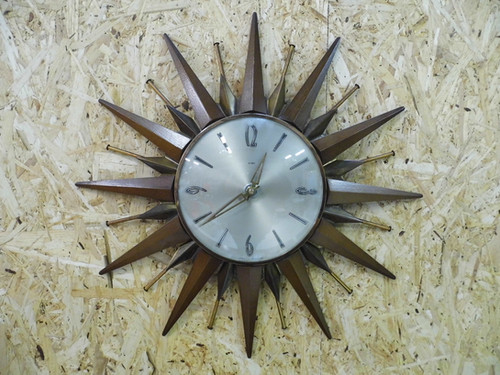
Locate an element on the screen. brown clock is located at coordinates click(246, 285).